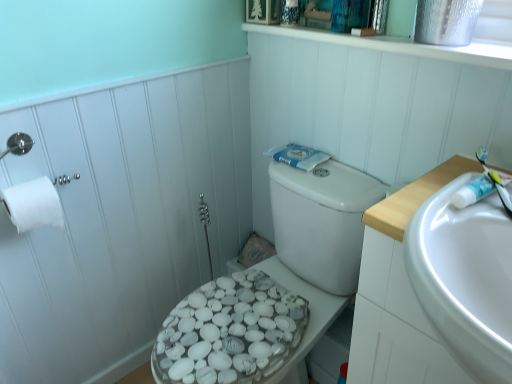
Measure the distance between white plastic toothbrush at right and camera.

The distance of white plastic toothbrush at right from camera is 29.48 inches.

What do you see at coordinates (495, 181) in the screenshot? The height and width of the screenshot is (384, 512). I see `white plastic toothbrush at right` at bounding box center [495, 181].

This screenshot has height=384, width=512. I want to click on white glossy sink at right, so click(x=465, y=278).

Locate an element on the screen. Image resolution: width=512 pixels, height=384 pixels. white glossy porcelain at center is located at coordinates (241, 328).

From the picture: Could you tell me if white plastic toothbrush at right is facing white glossy sink at right?

No, white plastic toothbrush at right is not oriented towards white glossy sink at right.

From a real-world perspective, which is physically above, white plastic toothbrush at right or white glossy sink at right?

From a 3D spatial view, white plastic toothbrush at right is above.

Can white glossy sink at right be found inside white plastic toothbrush at right?

No, white glossy sink at right is not inside white plastic toothbrush at right.

In terms of height, does white plastic toothbrush at right look taller or shorter compared to white glossy sink at right?

Clearly, white plastic toothbrush at right is shorter compared to white glossy sink at right.

From the image's perspective, is white glossy porcelain at center positioned above or below white plastic toothbrush at right?

white glossy porcelain at center is situated lower than white plastic toothbrush at right in the image.

Does white glossy porcelain at center have a smaller size compared to white plastic toothbrush at right?

Actually, white glossy porcelain at center might be larger than white plastic toothbrush at right.

Which object is positioned more to the left, white glossy porcelain at center or white plastic toothbrush at right?

white glossy porcelain at center.

Is white matte toilet paper at left spatially inside white glossy sink at right, or outside of it?

white matte toilet paper at left is located beyond the bounds of white glossy sink at right.

Considering the positions of point (20, 191) and point (438, 259), is point (20, 191) closer or farther from the camera than point (438, 259)?

Point (20, 191) is farther from the camera than point (438, 259).

From the picture: Between white matte toilet paper at left and white glossy sink at right, which one has smaller width?

white matte toilet paper at left is thinner.

Can you confirm if white matte toilet paper at left is positioned to the right of white glossy sink at right?

No.

Is white plastic toothbrush at right not close to white glossy porcelain at center?

They are positioned close to each other.

From their relative heights in the image, would you say white plastic toothbrush at right is taller or shorter than white glossy porcelain at center?

Considering their sizes, white plastic toothbrush at right has less height than white glossy porcelain at center.

What's the angular difference between white plastic toothbrush at right and white glossy porcelain at center's facing directions?

white plastic toothbrush at right and white glossy porcelain at center are facing 43 degrees away from each other.

Considering the sizes of white plastic toothbrush at right and white glossy porcelain at center in the image, is white plastic toothbrush at right bigger or smaller than white glossy porcelain at center?

Clearly, white plastic toothbrush at right is smaller in size than white glossy porcelain at center.

Between white glossy sink at right and white matte toilet paper at left, which one has smaller size?

With smaller size is white matte toilet paper at left.

At what (x,y) coordinates should I click in order to perform the action: click on toilet paper above the white glossy sink at right (from the image's perspective). Please return your answer as a coordinate pair (x, y). Looking at the image, I should click on (33, 204).

Is white glossy sink at right in contact with white matte toilet paper at left?

They are not placed beside each other.

Does white glossy sink at right turn towards white matte toilet paper at left?

No, white glossy sink at right is not aimed at white matte toilet paper at left.

Does white pebble-patterned toilet seat at left come in front of white plastic toothbrush at right?

No, it is not.

Where is `toothbrush that appears in front of the white pebble-patterned toilet seat at left`? toothbrush that appears in front of the white pebble-patterned toilet seat at left is located at coordinates (495, 181).

Which object is wider, white pebble-patterned toilet seat at left or white plastic toothbrush at right?

Wider between the two is white plastic toothbrush at right.

Who is shorter, white pebble-patterned toilet seat at left or white glossy porcelain at center?

With less height is white glossy porcelain at center.

From a real-world perspective, is white pebble-patterned toilet seat at left physically located above or below white glossy porcelain at center?

white pebble-patterned toilet seat at left is situated higher than white glossy porcelain at center in the real world.

Considering the positions of objects white pebble-patterned toilet seat at left and white glossy porcelain at center in the image provided, who is more to the left, white pebble-patterned toilet seat at left or white glossy porcelain at center?

Positioned to the left is white pebble-patterned toilet seat at left.

From the picture: Is white glossy porcelain at center inside white pebble-patterned toilet seat at left?

No, white glossy porcelain at center is not inside white pebble-patterned toilet seat at left.

This screenshot has height=384, width=512. I want to click on toothbrush above the white glossy sink at right (from the image's perspective), so click(x=495, y=181).

Where is `porcelain that is under the white plastic toothbrush at right (from a real-world perspective)`? This screenshot has height=384, width=512. porcelain that is under the white plastic toothbrush at right (from a real-world perspective) is located at coordinates (241, 328).

Based on their spatial positions, is white plastic toothbrush at right or white matte toilet paper at left further from white glossy sink at right?

white matte toilet paper at left.

Estimate the real-world distances between objects in this image. Which object is closer to white matte toilet paper at left, white glossy porcelain at center or white glossy sink at right?

The object closer to white matte toilet paper at left is white glossy porcelain at center.

Which object lies nearer to the anchor point white matte toilet paper at left, white plastic toothbrush at right or white pebble-patterned toilet seat at left?

white pebble-patterned toilet seat at left.

When comparing their distances from white glossy sink at right, does white plastic toothbrush at right or white pebble-patterned toilet seat at left seem further?

The object further to white glossy sink at right is white pebble-patterned toilet seat at left.

Which object lies nearer to the anchor point white matte toilet paper at left, white glossy porcelain at center or white plastic toothbrush at right?

Among the two, white glossy porcelain at center is located nearer to white matte toilet paper at left.

Consider the image. Considering their positions, is white matte toilet paper at left positioned further to white glossy porcelain at center than white plastic toothbrush at right?

Among the two, white plastic toothbrush at right is located further to white glossy porcelain at center.

From the image, which object appears to be nearer to white plastic toothbrush at right, white pebble-patterned toilet seat at left or white glossy porcelain at center?

The object closer to white plastic toothbrush at right is white glossy porcelain at center.

Estimate the real-world distances between objects in this image. Which object is closer to white glossy sink at right, white pebble-patterned toilet seat at left or white plastic toothbrush at right?

Based on the image, white plastic toothbrush at right appears to be nearer to white glossy sink at right.

Locate an element on the screen. side located between white matte toilet paper at left and white glossy sink at right in the left-right direction is located at coordinates (121, 219).

Find the location of a particular element. The image size is (512, 384). sink situated between white pebble-patterned toilet seat at left and white plastic toothbrush at right from left to right is located at coordinates (465, 278).

Find the location of a particular element. porcelain situated between white matte toilet paper at left and white glossy sink at right from left to right is located at coordinates (241, 328).

Locate an element on the screen. porcelain located between white pebble-patterned toilet seat at left and white plastic toothbrush at right in the left-right direction is located at coordinates (241, 328).